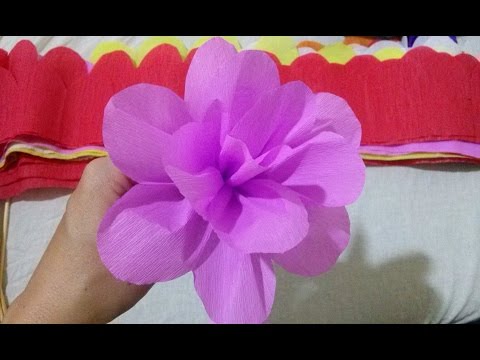
This screenshot has height=360, width=480. Identify the location of wall. (43, 218), (429, 217).